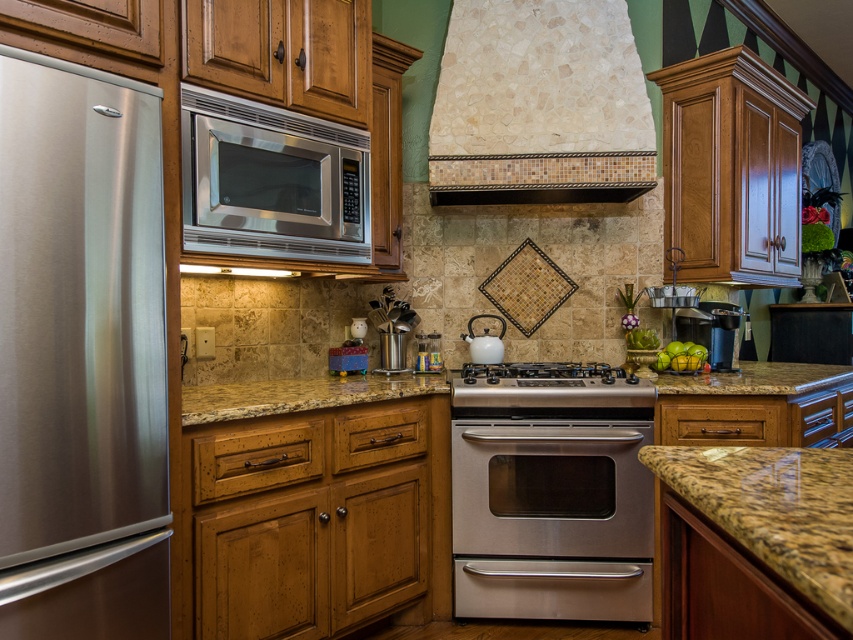
Does granite at center have a lesser width compared to stainless steel gas stove at center?

No, granite at center is not thinner than stainless steel gas stove at center.

Identify the location of granite at center. The image size is (853, 640). (299, 394).

Between stainless steel oven at center and stainless steel gas stove at center, which one has more height?

stainless steel oven at center is taller.

Measure the distance between stainless steel oven at center and camera.

stainless steel oven at center is 8.49 feet away from camera.

The image size is (853, 640). I want to click on stainless steel oven at center, so click(x=550, y=497).

Based on the photo, can you confirm if stainless steel oven at center is positioned below granite at center?

Correct, stainless steel oven at center is located below granite at center.

Does stainless steel oven at center come behind granite at center?

Yes, stainless steel oven at center is further from the viewer.

Does point (451, 419) come in front of point (242, 387)?

That is False.

Find the location of `stainless steel oven at center`. stainless steel oven at center is located at coordinates (550, 497).